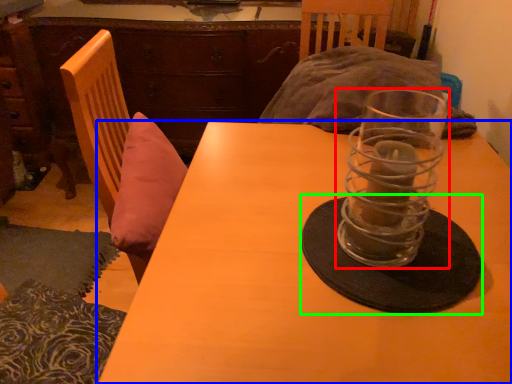
Question: Based on their relative distances, which object is farther from tableware (highlighted by a red box)? Choose from table (highlighted by a blue box) and glass plate (highlighted by a green box).

Choices:
 (A) table
 (B) glass plate

Answer: (A)